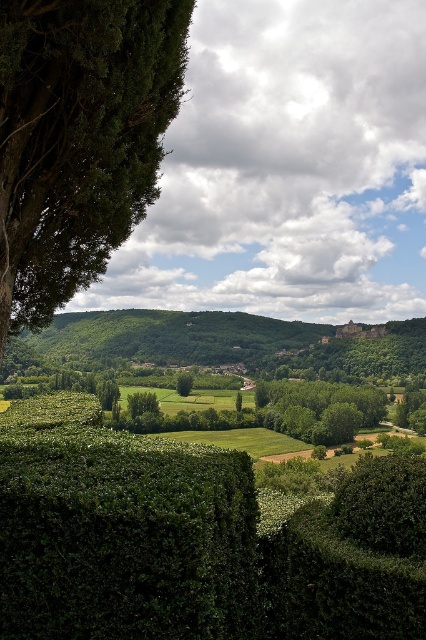
Describe the element at coordinates (193, 540) in the screenshot. I see `green leafy hedge at center` at that location.

Which is behind, point (414, 557) or point (25, 179)?

The point (25, 179) is more distant.

Who is more forward, (25, 435) or (154, 16)?

Positioned in front is point (25, 435).

At what (x,y) coordinates should I click in order to perform the action: click on green leafy hedge at center. Please return your answer as a coordinate pair (x, y). This screenshot has height=640, width=426. Looking at the image, I should click on (193, 540).

Can you confirm if green leafy bush at center is bigger than green leafy tree at center?

Yes, green leafy bush at center is bigger than green leafy tree at center.

Identify the location of green leafy bush at center. (319, 408).

I want to click on green leafy bush at center, so click(x=319, y=408).

Who is lower down, green leafy hedge at center or green leafy tree at center?

green leafy tree at center

Which is above, green leafy hedge at center or green leafy tree at center?

Positioned higher is green leafy hedge at center.

Is point (345, 563) less distant than point (189, 392)?

That is True.

Where is `green leafy hedge at center`? This screenshot has width=426, height=640. green leafy hedge at center is located at coordinates (193, 540).